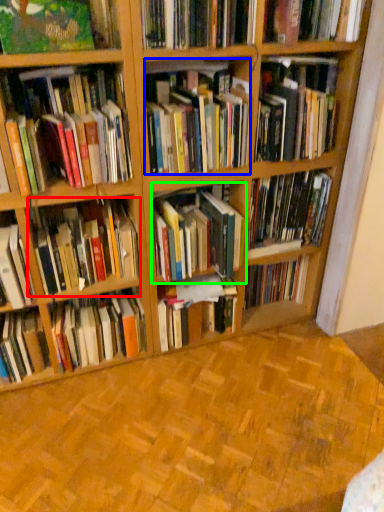
Question: Which object is the closest to the book (highlighted by a red box)? Choose among these: book (highlighted by a blue box) or book (highlighted by a green box).

Choices:
 (A) book
 (B) book

Answer: (B)